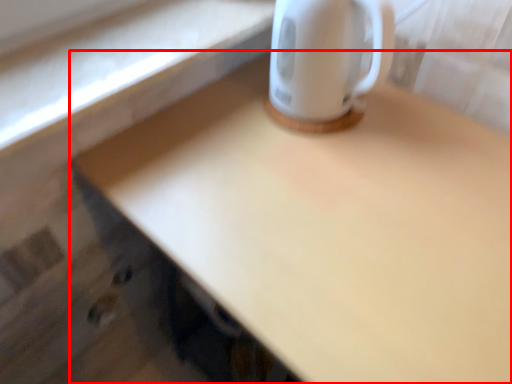
Question: Where is desk (annotated by the red box) located in relation to coffee cup in the image?

Choices:
 (A) right
 (B) left

Answer: (A)